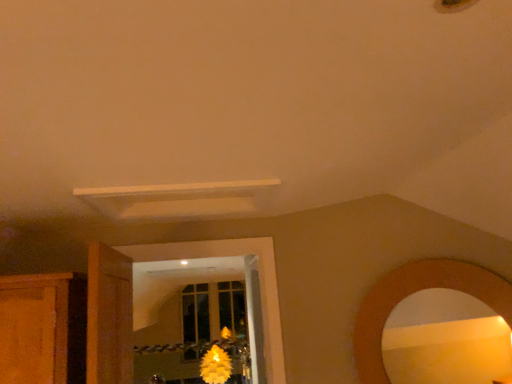
Question: Based on their positions, is wooden door at left located to the left or right of wooden mirror at lower right?

Choices:
 (A) left
 (B) right

Answer: (A)

Question: In terms of size, does wooden door at left appear bigger or smaller than wooden mirror at lower right?

Choices:
 (A) small
 (B) big

Answer: (B)

Question: Which object is the farthest from the wooden mirror at lower right?

Choices:
 (A) wooden door at left
 (B) yellow matte flower at center

Answer: (B)

Question: Considering the real-world distances, which object is closest to the wooden mirror at lower right?

Choices:
 (A) wooden door at left
 (B) yellow matte flower at center

Answer: (A)